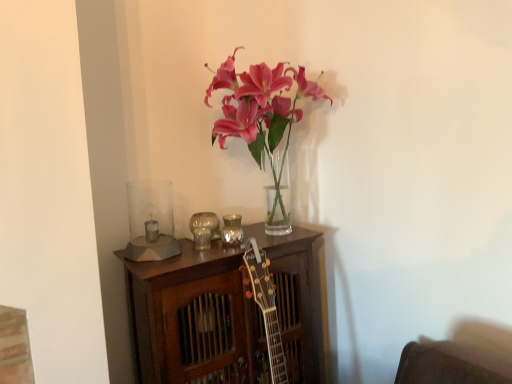
Question: Is metallic reflective candle holder at center, which ranks as the 3th candle holder in left-to-right order, smaller than metallic silver candle holder at center, the 2th candle holder viewed from the left?

Choices:
 (A) yes
 (B) no

Answer: (A)

Question: From a real-world perspective, is metallic reflective candle holder at center, which ranks as the 3th candle holder in left-to-right order, physically above metallic silver candle holder at center, the 2th candle holder viewed from the left?

Choices:
 (A) yes
 (B) no

Answer: (A)

Question: From a real-world perspective, is metallic reflective candle holder at center, which ranks as the 3th candle holder in left-to-right order, below metallic silver candle holder at center, the 2th candle holder viewed from the left?

Choices:
 (A) yes
 (B) no

Answer: (B)

Question: Is metallic reflective candle holder at center, acting as the first candle holder starting from the right, positioned before metallic silver candle holder at center, acting as the second candle holder starting from the right?

Choices:
 (A) yes
 (B) no

Answer: (B)

Question: From the image's perspective, is metallic reflective candle holder at center, acting as the first candle holder starting from the right, above metallic silver candle holder at center, the 2th candle holder viewed from the left?

Choices:
 (A) yes
 (B) no

Answer: (A)

Question: Does metallic reflective candle holder at center, which ranks as the 3th candle holder in left-to-right order, have a larger size compared to metallic silver candle holder at center, acting as the second candle holder starting from the right?

Choices:
 (A) no
 (B) yes

Answer: (A)

Question: Can you confirm if metallic reflective candle holder at center, acting as the first candle holder starting from the right, is taller than clear glass candle holder at left, acting as the third candle holder starting from the right?

Choices:
 (A) no
 (B) yes

Answer: (A)

Question: From the image's perspective, is metallic reflective candle holder at center, which ranks as the 3th candle holder in left-to-right order, beneath clear glass candle holder at left, positioned as the 1th candle holder in left-to-right order?

Choices:
 (A) yes
 (B) no

Answer: (B)

Question: Is clear glass candle holder at left, acting as the third candle holder starting from the right, at the back of metallic reflective candle holder at center, acting as the first candle holder starting from the right?

Choices:
 (A) yes
 (B) no

Answer: (B)

Question: Is metallic reflective candle holder at center, which ranks as the 3th candle holder in left-to-right order, in front of clear glass candle holder at left, positioned as the 1th candle holder in left-to-right order?

Choices:
 (A) no
 (B) yes

Answer: (A)

Question: Is metallic reflective candle holder at center, acting as the first candle holder starting from the right, to the left of clear glass candle holder at left, positioned as the 1th candle holder in left-to-right order, from the viewer's perspective?

Choices:
 (A) yes
 (B) no

Answer: (B)

Question: From the image's perspective, is metallic reflective candle holder at center, acting as the first candle holder starting from the right, located above clear glass candle holder at left, acting as the third candle holder starting from the right?

Choices:
 (A) no
 (B) yes

Answer: (B)

Question: From the image's perspective, would you say clear glass candle holder at left, acting as the third candle holder starting from the right, is positioned over metallic silver candle holder at center, the 2th candle holder viewed from the left?

Choices:
 (A) no
 (B) yes

Answer: (A)